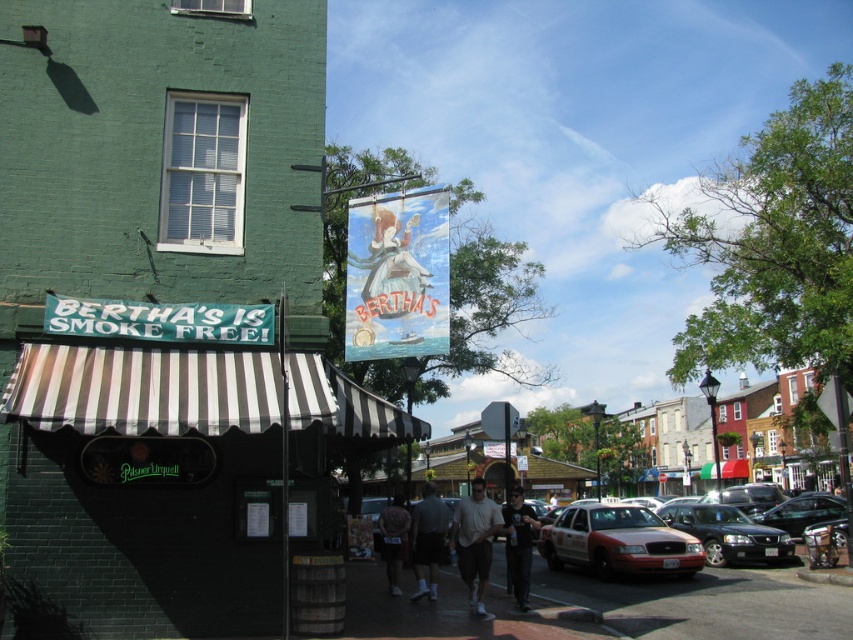
You are driving a shiny black sedan at center and want to park it on the smooth asphalt road at center. Can you fit the car on the road without overlapping the road edges?

The smooth asphalt road at center might be wider than shiny black sedan at center, so there is a possibility that the car can fit without overlapping the edges, but it depends on the exact width difference.